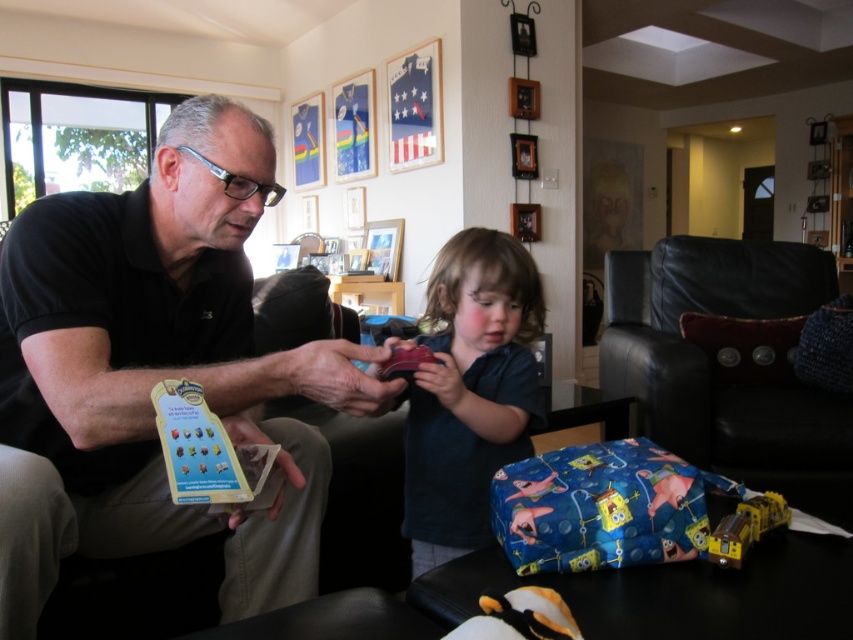
Can you confirm if matte black shirt at left is bigger than dark blue shirt at center?

Indeed, matte black shirt at left has a larger size compared to dark blue shirt at center.

Between matte black shirt at left and dark blue shirt at center, which one appears on the left side from the viewer's perspective?

Positioned to the left is matte black shirt at left.

Does point (106, 484) lie in front of point (482, 344)?

That is True.

Image resolution: width=853 pixels, height=640 pixels. I want to click on matte black shirt at left, so click(x=155, y=371).

Is dark blue shirt at center positioned in front of metallic yellow train at lower right?

No.

Looking at this image, who is higher up, dark blue shirt at center or metallic yellow train at lower right?

Positioned higher is dark blue shirt at center.

The height and width of the screenshot is (640, 853). Identify the location of dark blue shirt at center. (469, 392).

Between black leather armchair at right and dark blue shirt at center, which one appears on the right side from the viewer's perspective?

black leather armchair at right is more to the right.

Find the location of a particular element. black leather armchair at right is located at coordinates (714, 362).